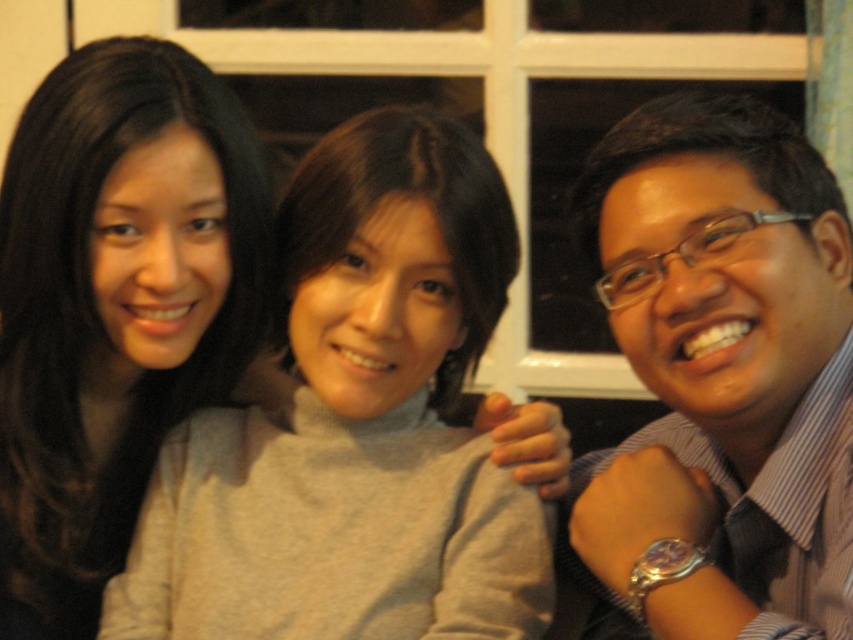
Question: Which object appears farthest from the camera in this image?

Choices:
 (A) gray matte sweater at center
 (B) matte black shirt at right

Answer: (A)

Question: Estimate the real-world distances between objects in this image. Which object is closer to the matte gray sweater at center?

Choices:
 (A) gray matte sweater at center
 (B) matte black shirt at right

Answer: (A)

Question: From the image, what is the correct spatial relationship of matte black shirt at right in relation to matte gray sweater at center?

Choices:
 (A) above
 (B) below

Answer: (B)

Question: Does gray matte sweater at center appear under matte black shirt at right?

Choices:
 (A) no
 (B) yes

Answer: (B)

Question: Which of the following is the closest to the observer?

Choices:
 (A) (641, 276)
 (B) (90, 70)

Answer: (A)

Question: Is matte black shirt at right in front of matte gray sweater at center?

Choices:
 (A) yes
 (B) no

Answer: (A)